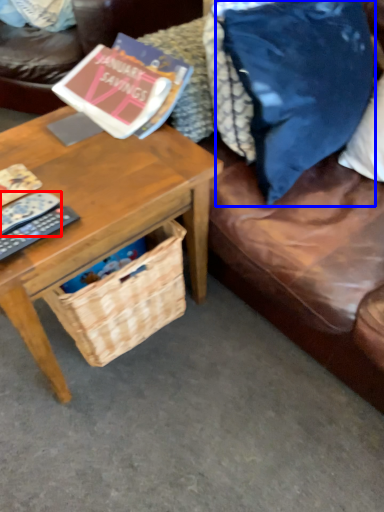
Question: Among these objects, which one is nearest to the camera, remote control (highlighted by a red box) or throw pillow (highlighted by a blue box)?

Choices:
 (A) remote control
 (B) throw pillow

Answer: (B)